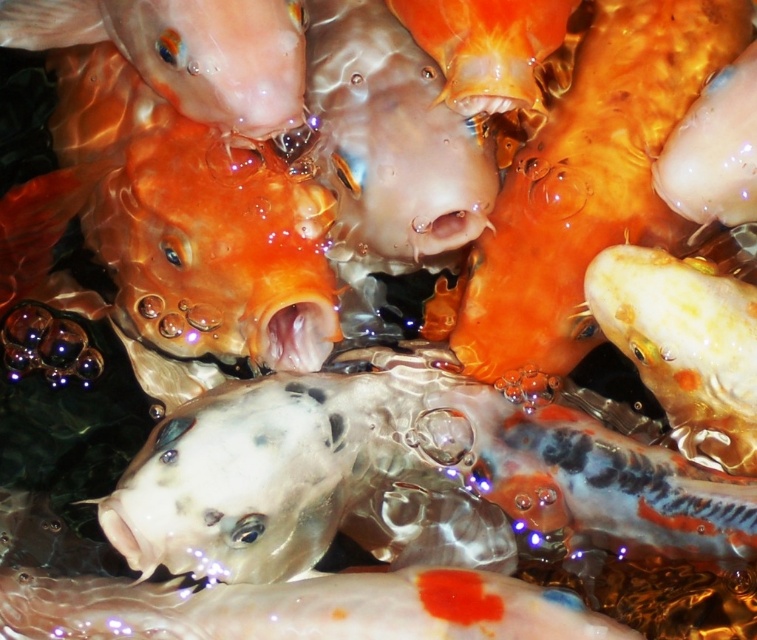
Question: Among these points, which one is farthest from the camera?

Choices:
 (A) (435, 186)
 (B) (659, 342)
 (C) (743, 161)

Answer: (A)

Question: Does translucent white fish at center appear over translucent orange fish at upper right?

Choices:
 (A) no
 (B) yes

Answer: (A)

Question: Is translucent orange fish at center bigger than translucent orange fish at upper right?

Choices:
 (A) yes
 (B) no

Answer: (A)

Question: Which object is the closest to the translucent orange fish at center?

Choices:
 (A) translucent orange fish at upper right
 (B) matte orange fish at upper left
 (C) shiny white fish at bottom
 (D) translucent white fish at center

Answer: (B)

Question: Does translucent orange fish at center have a greater width compared to shiny white fish at center?

Choices:
 (A) no
 (B) yes

Answer: (B)

Question: Which is nearer to the translucent white fish at center?

Choices:
 (A) translucent orange fish at center
 (B) matte orange fish at upper left
 (C) orange glossy goldfish at upper center
 (D) shiny white fish at bottom

Answer: (D)